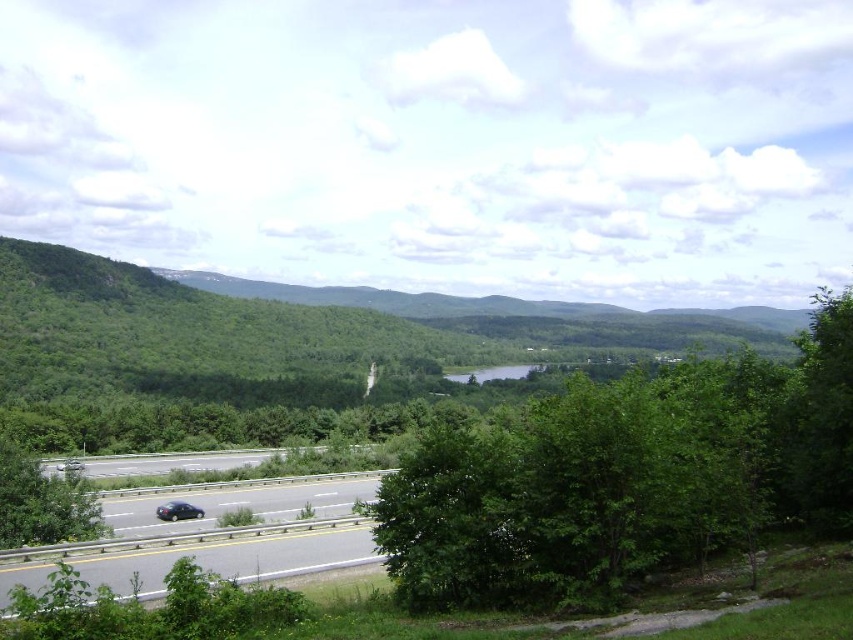
Question: Does green leafy tree at center come behind shiny black sedan at lower left?

Choices:
 (A) no
 (B) yes

Answer: (A)

Question: Which point is closer to the camera?

Choices:
 (A) green leafy tree at center
 (B) shiny black sedan at lower left
 (C) black asphalt highway at lower left

Answer: (A)

Question: Estimate the real-world distances between objects in this image. Which object is farther from the shiny black sedan at lower left?

Choices:
 (A) green leafy tree at center
 (B) black asphalt highway at lower left

Answer: (A)

Question: Can you confirm if black asphalt highway at lower left is positioned to the left of shiny black sedan at lower left?

Choices:
 (A) no
 (B) yes

Answer: (A)

Question: Can you confirm if black asphalt highway at lower left is positioned to the left of shiny black sedan at lower left?

Choices:
 (A) no
 (B) yes

Answer: (A)

Question: Which is farther from the green leafy tree at center?

Choices:
 (A) shiny black sedan at lower left
 (B) black asphalt highway at lower left

Answer: (A)